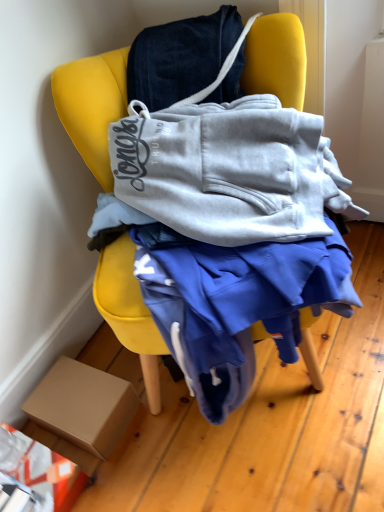
Question: Is yellow fabric chair at center wider or thinner than brown cardboard box at lower left?

Choices:
 (A) thin
 (B) wide

Answer: (B)

Question: Is yellow fabric chair at center in front of or behind brown cardboard box at lower left in the image?

Choices:
 (A) front
 (B) behind

Answer: (A)

Question: Based on their positions, is yellow fabric chair at center located to the left or right of brown cardboard box at lower left?

Choices:
 (A) left
 (B) right

Answer: (B)

Question: Is brown cardboard box at lower left inside the boundaries of yellow fabric chair at center, or outside?

Choices:
 (A) outside
 (B) inside

Answer: (A)

Question: Is brown cardboard box at lower left in front of or behind yellow fabric chair at center in the image?

Choices:
 (A) front
 (B) behind

Answer: (B)

Question: From a real-world perspective, is brown cardboard box at lower left above or below yellow fabric chair at center?

Choices:
 (A) below
 (B) above

Answer: (A)

Question: In the image, is brown cardboard box at lower left on the left side or the right side of yellow fabric chair at center?

Choices:
 (A) right
 (B) left

Answer: (B)